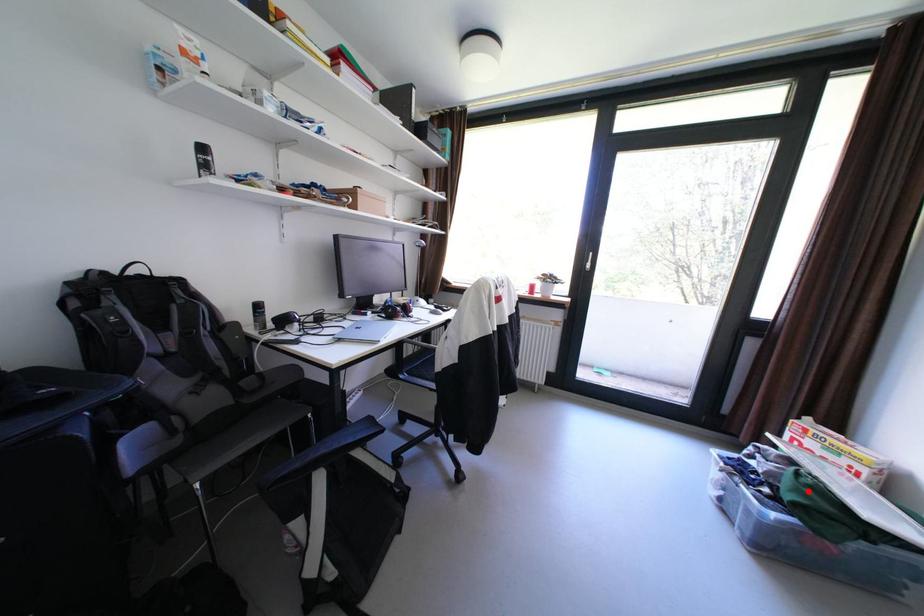
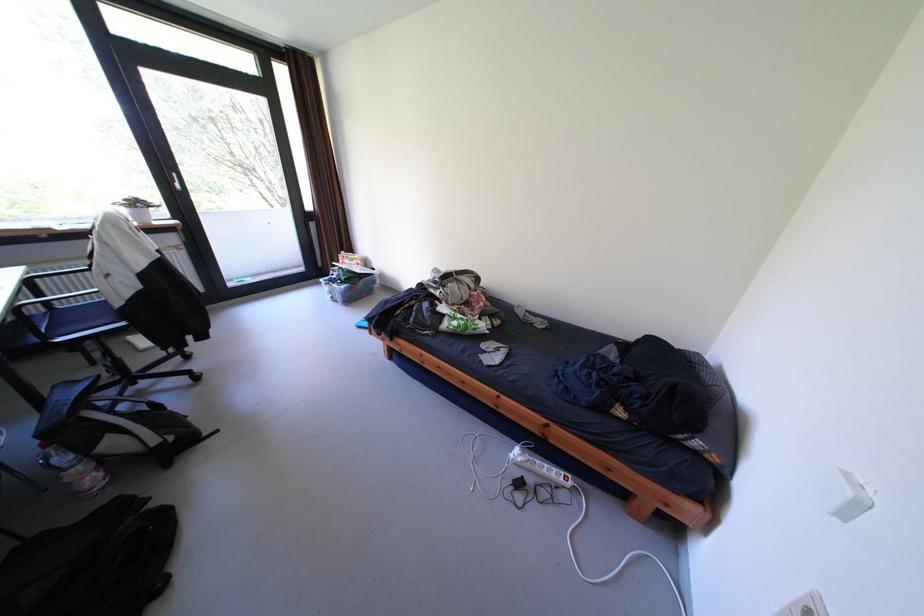
Question: I am providing you with two images of the same scene from different viewpoints. In image1, a red point is highlighted. Considering the same 3D point in image2, which of the following is correct?

Choices:
 (A) It is closer
 (B) It is farther

Answer: (A)